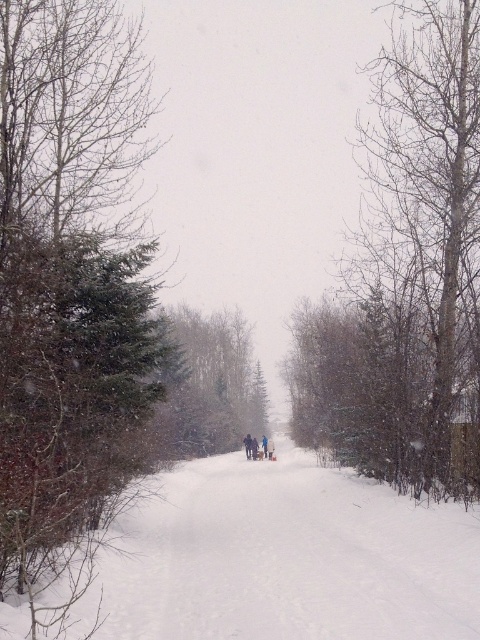
Question: Which point is farther to the camera?

Choices:
 (A) bare wood tree at right
 (B) green matte tree at center
 (C) green textured evergreen at left

Answer: (B)

Question: Which of the following is the closest to the observer?

Choices:
 (A) (443, 400)
 (B) (120, 314)

Answer: (B)

Question: Can you confirm if bare wood tree at right is bigger than green matte tree at center?

Choices:
 (A) no
 (B) yes

Answer: (B)

Question: Which of the following is the closest to the observer?

Choices:
 (A) bare wood tree at right
 (B) green textured evergreen at left

Answer: (B)

Question: Is bare wood tree at right positioned behind green matte tree at center?

Choices:
 (A) yes
 (B) no

Answer: (B)

Question: Is green textured evergreen at left wider than green matte tree at center?

Choices:
 (A) no
 (B) yes

Answer: (A)